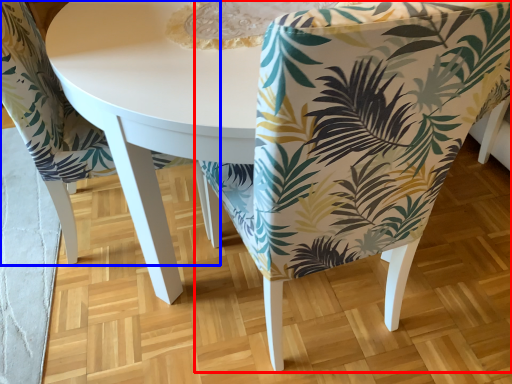
Question: Which object appears closest to the camera in this image, chair (highlighted by a red box) or chair (highlighted by a blue box)?

Choices:
 (A) chair
 (B) chair

Answer: (A)